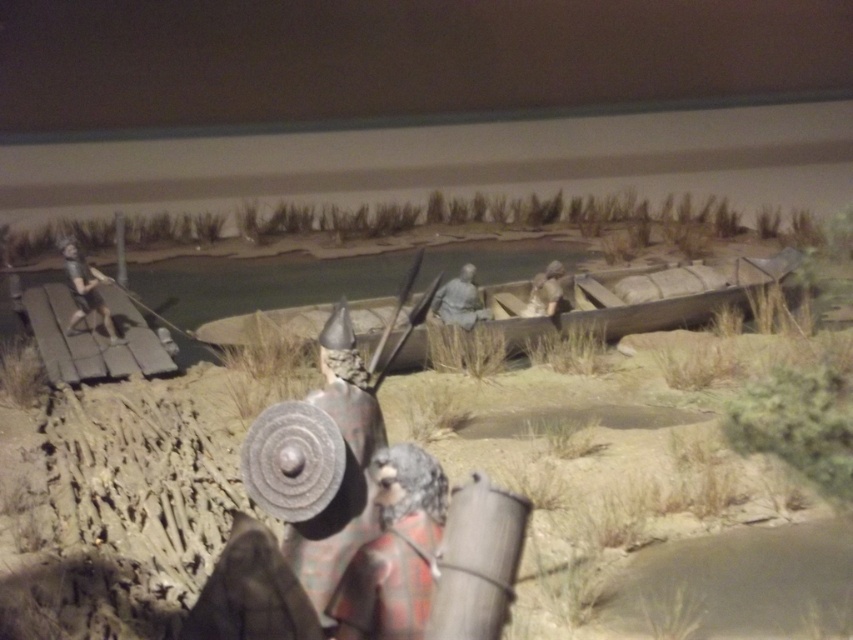
Question: Which point is farther to the camera?

Choices:
 (A) (480, 308)
 (B) (96, 284)
 (C) (660, 330)

Answer: (C)

Question: Is matte gray helmet at left smaller than gray stone figure at center?

Choices:
 (A) no
 (B) yes

Answer: (A)

Question: Does wooden boat at center have a larger size compared to gray stone figure at center?

Choices:
 (A) no
 (B) yes

Answer: (B)

Question: Which object appears closest to the camera in this image?

Choices:
 (A) matte gray helmet at left
 (B) wooden boat at center

Answer: (A)

Question: Which object is the closest to the gray stone figure at center?

Choices:
 (A) wooden boat at center
 (B) matte gray helmet at left

Answer: (A)

Question: Can you confirm if wooden boat at center is smaller than matte gray helmet at left?

Choices:
 (A) yes
 (B) no

Answer: (B)